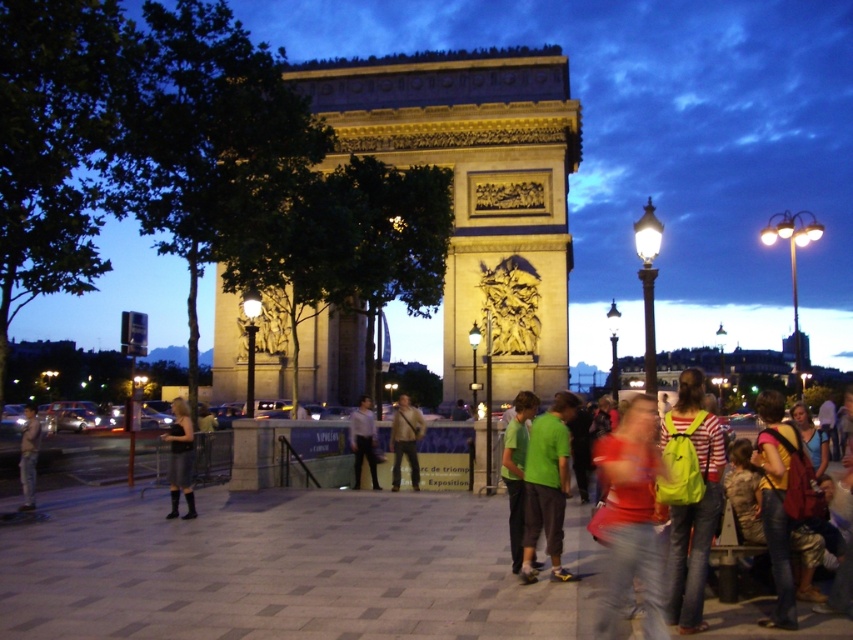
In the scene shown: You are a tourist standing in the plaza in front of the golden stone arch at center. You notice the matte red shirt at center nearby. Which object is larger in size?

The golden stone arch at center is bigger than the matte red shirt at center.

You are a tour guide leading a group near the Arc de Triomphe. You notice a tourist wearing a matte red shirt at center and another carrying a yellow backpack at lower right. If the average walking speed is 3 feet per second, how many seconds will it take for them to meet if they start walking towards each other at the same time?

The distance between the matte red shirt at center and the yellow backpack at lower right is 47.85 feet. If they walk towards each other at 3 feet per second each, their combined speed is 6 feet per second. Dividing the distance by the combined speed gives 47.85 divided by 6 equals approximately 7.98 seconds, so roughly 8 seconds.